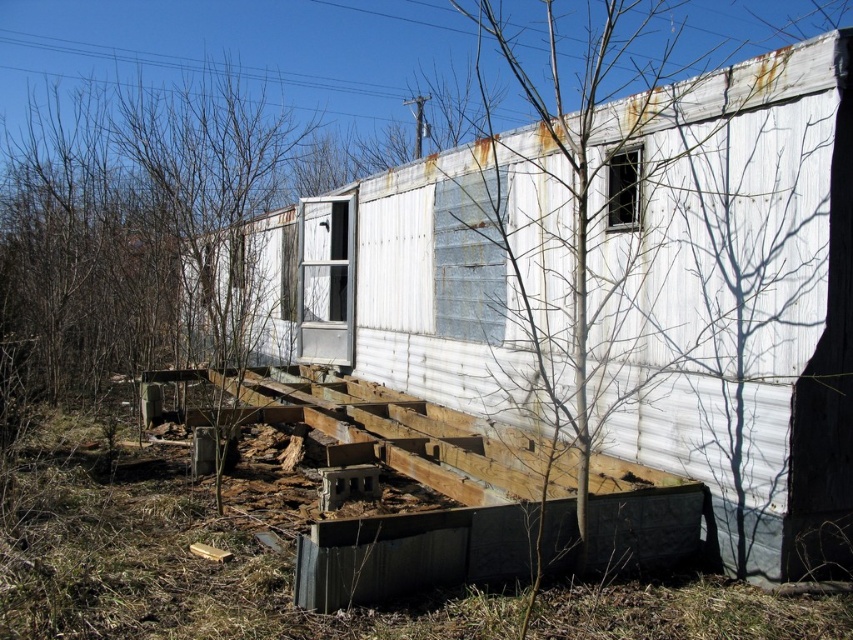
You are standing in front of the mobile home and want to take a photo. There are two points marked on the image, point 1 at coordinates point (x=798, y=348) and point 2 at coordinates point (x=572, y=504). Which point will appear larger in your photo?

Point 1 at coordinates point (x=798, y=348) will appear larger in the photo because it is closer to the camera than point (x=572, y=504).

You are standing at the point marked as point (413,554) in the image. What is the object directly beneath your feet?

The point (413,554) corresponds to the metallic gray foundation at lower center.

You are standing in front of the mobile home and notice the metallic gray foundation at lower center and the bare wood tree at center. Which object is positioned to the left when viewed from your perspective?

The metallic gray foundation at lower center is to the left of the bare wood tree at center.